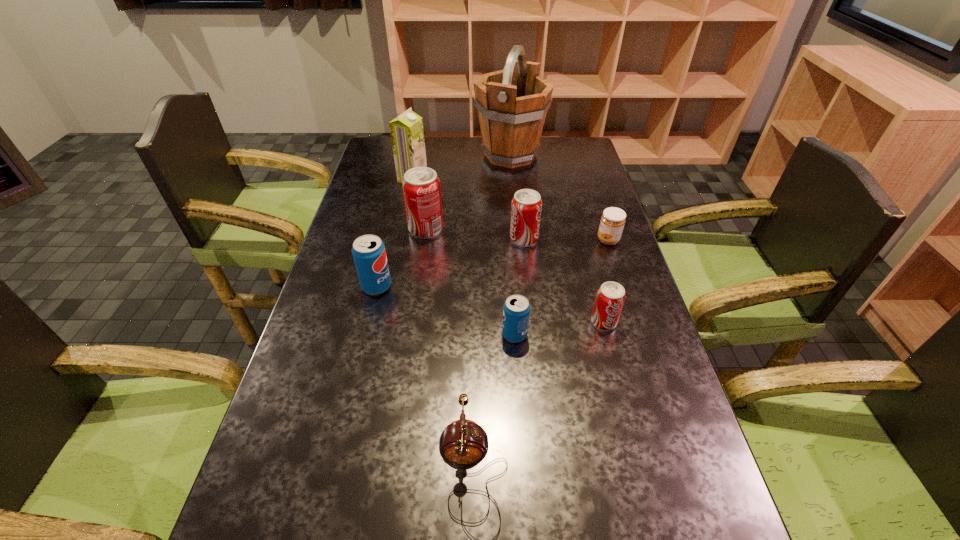
Locate which object ranks third in proximity to the second tallest object. Please provide its 2D coordinates. Your answer should be formatted as a tuple, i.e. [(x, y)], where the tuple contains the x and y coordinates of a point satisfying the conditions above.

[(526, 206)]

Point out which soda can is positioned as the fifth nearest to the tallest object. Please provide its 2D coordinates. Your answer should be formatted as a tuple, i.e. [(x, y)], where the tuple contains the x and y coordinates of a point satisfying the conditions above.

[(516, 311)]

The height and width of the screenshot is (540, 960). I want to click on soda can that is the second closest to the second red soda can from right to left, so click(610, 297).

Identify which red soda can is located as the second nearest to the second red soda can from left to right. Please provide its 2D coordinates. Your answer should be formatted as a tuple, i.e. [(x, y)], where the tuple contains the x and y coordinates of a point satisfying the conditions above.

[(610, 297)]

Locate which red soda can ranks in proximity to the right blue soda can. Please provide its 2D coordinates. Your answer should be formatted as a tuple, i.e. [(x, y)], where the tuple contains the x and y coordinates of a point satisfying the conditions above.

[(610, 297)]

The image size is (960, 540). Find the location of `free point that satisfies the following two spatial constraints: 1. on the back side of the nearest red soda can; 2. on the right side of the smaller blue soda can`. free point that satisfies the following two spatial constraints: 1. on the back side of the nearest red soda can; 2. on the right side of the smaller blue soda can is located at coordinates (514, 322).